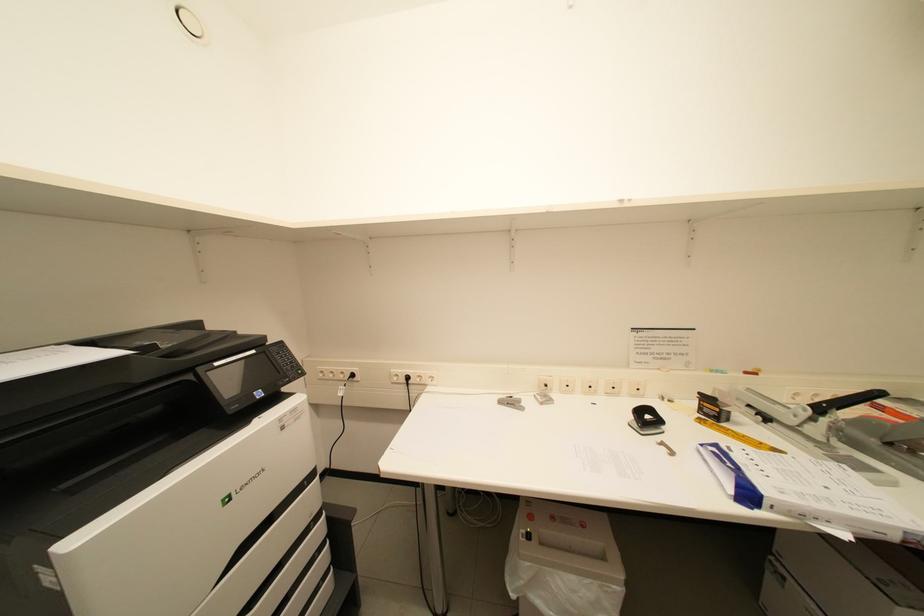
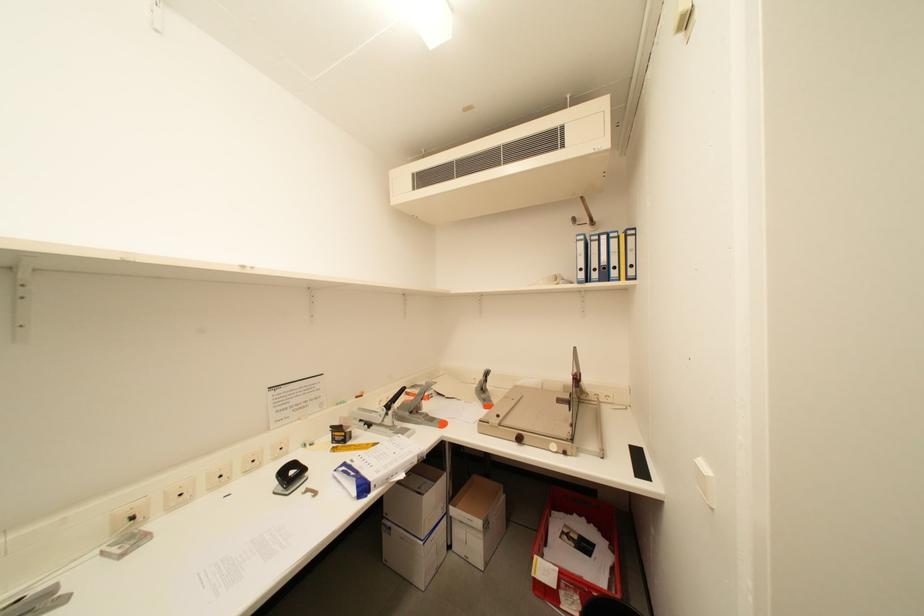
Question: The camera is either moving clockwise (left) or counter-clockwise (right) around the object. The first image is from the beginning of the video and the second image is from the end. Is the camera moving left or right when shooting the video?

Choices:
 (A) Left
 (B) Right

Answer: (A)